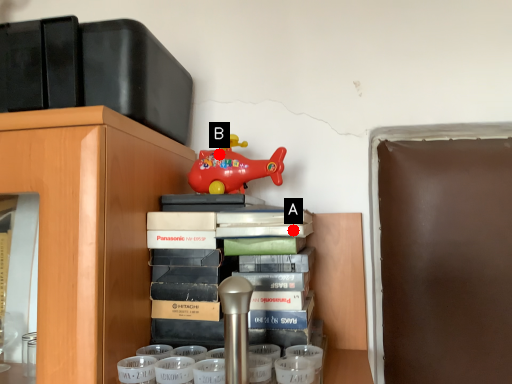
Question: Two points are circled on the image, labeled by A and B beside each circle. Among these points, which one is farthest from the camera?

Choices:
 (A) A is further
 (B) B is further

Answer: (B)